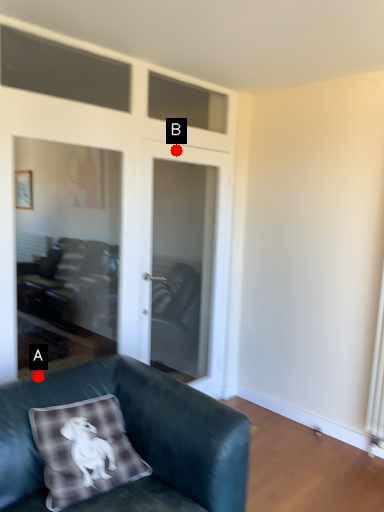
Question: Two points are circled on the image, labeled by A and B beside each circle. Which point is closer to the camera?

Choices:
 (A) A is closer
 (B) B is closer

Answer: (A)